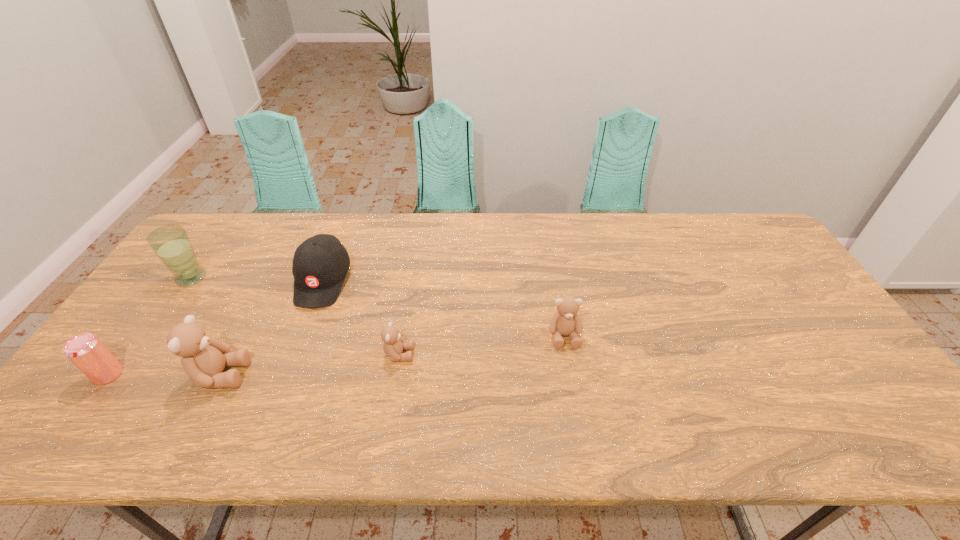
At what (x,y) coordinates should I click in order to perform the action: click on object that is at the near left corner. Please return your answer as a coordinate pair (x, y). This screenshot has width=960, height=540. Looking at the image, I should click on (85, 350).

In the image, there is a desktop. Identify the location of free space at the far edge. (328, 225).

This screenshot has height=540, width=960. In the image, there is a desktop. Identify the location of blank space at the near edge. (667, 394).

Where is `vacant area at the left edge`? Image resolution: width=960 pixels, height=540 pixels. vacant area at the left edge is located at coordinates (154, 354).

In the image, there is a desktop. What are the coordinates of `vacant area at the right edge` in the screenshot? It's located at (787, 280).

You are a GUI agent. You are given a task and a screenshot of the screen. Output one action in this format:
    pyautogui.click(x=<x>, y=<y>)
    Task: Click on the vacant area between the rightmost teddy bear and the beer can
    
    Given the screenshot: What is the action you would take?
    pyautogui.click(x=336, y=355)

You are a GUI agent. You are given a task and a screenshot of the screen. Output one action in this format:
    pyautogui.click(x=<x>, y=<y>)
    Task: Click on the vacant area between the beer can and the fourth object from right to left
    This screenshot has width=960, height=540.
    Given the screenshot: What is the action you would take?
    pyautogui.click(x=164, y=374)

You are a GUI agent. You are given a task and a screenshot of the screen. Output one action in this format:
    pyautogui.click(x=<x>, y=<y>)
    Task: Click on the vacant space in between the glass and the second teddy bear from right to left
    Image resolution: width=960 pixels, height=540 pixels.
    Given the screenshot: What is the action you would take?
    pyautogui.click(x=295, y=316)

You are a GUI agent. You are given a task and a screenshot of the screen. Output one action in this format:
    pyautogui.click(x=<x>, y=<y>)
    Task: Click on the free space between the leftmost teddy bear and the baseball cap
    The height and width of the screenshot is (540, 960).
    Given the screenshot: What is the action you would take?
    pyautogui.click(x=272, y=328)

The image size is (960, 540). Find the location of `vacant point located between the glass and the rightmost object`. vacant point located between the glass and the rightmost object is located at coordinates (377, 307).